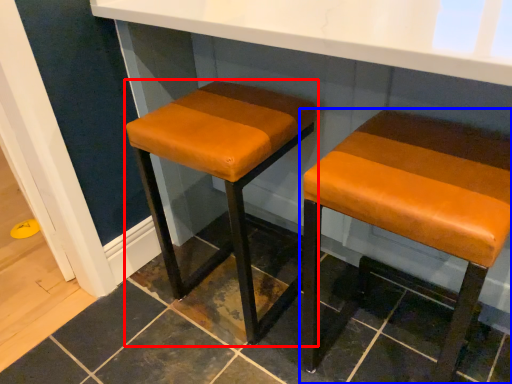
Question: Among these objects, which one is nearest to the camera, stool (highlighted by a red box) or stool (highlighted by a blue box)?

Choices:
 (A) stool
 (B) stool

Answer: (B)